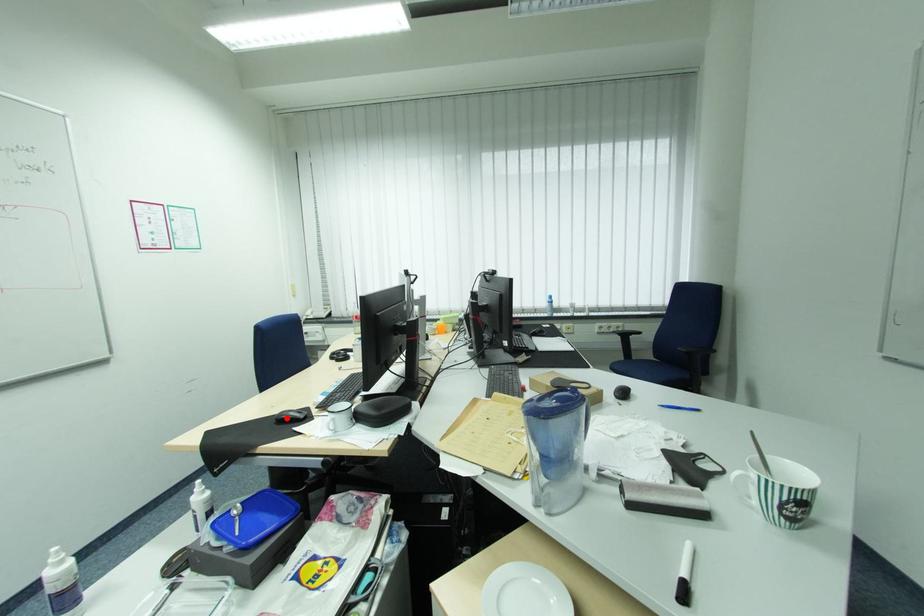
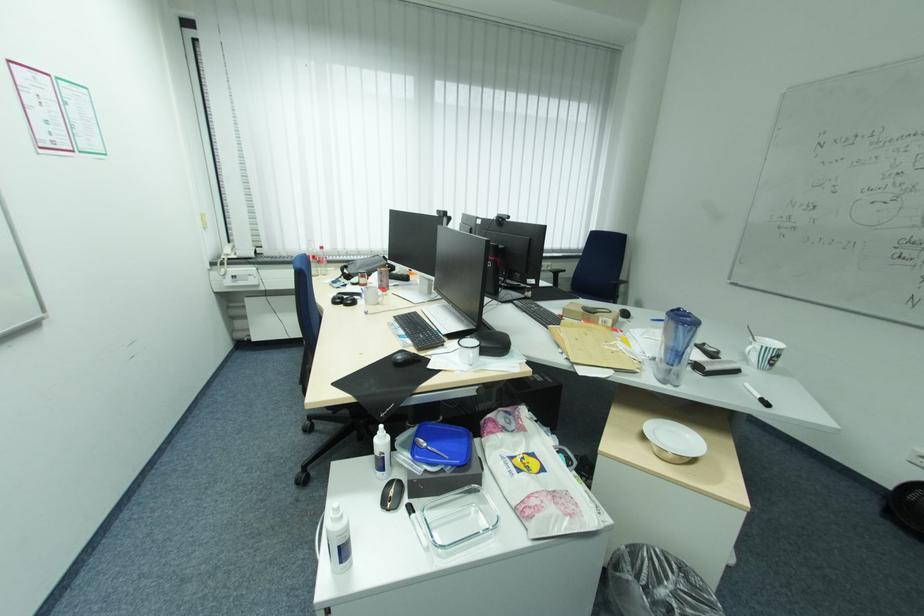
Locate, in the second image, the point that corresponds to the highlighted location in the first image.

(406, 361)